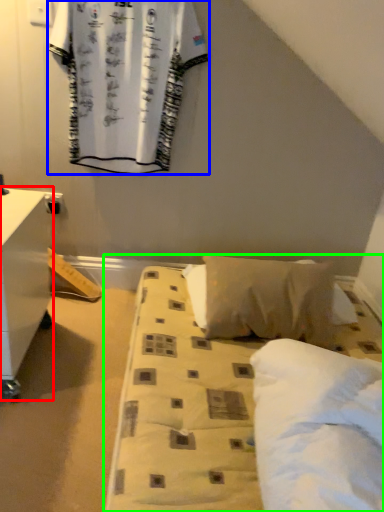
Question: Based on their relative distances, which object is farther from nightstand (highlighted by a red box)? Choose from curtain (highlighted by a blue box) and bed (highlighted by a green box).

Choices:
 (A) curtain
 (B) bed

Answer: (A)